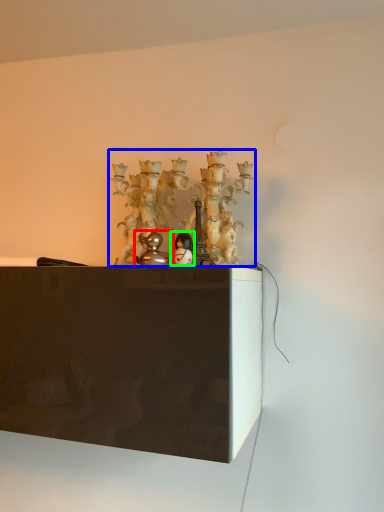
Question: Which object is the closest to the toy (highlighted by a red box)? Choose among these: art (highlighted by a blue box) or toy (highlighted by a green box).

Choices:
 (A) art
 (B) toy

Answer: (B)